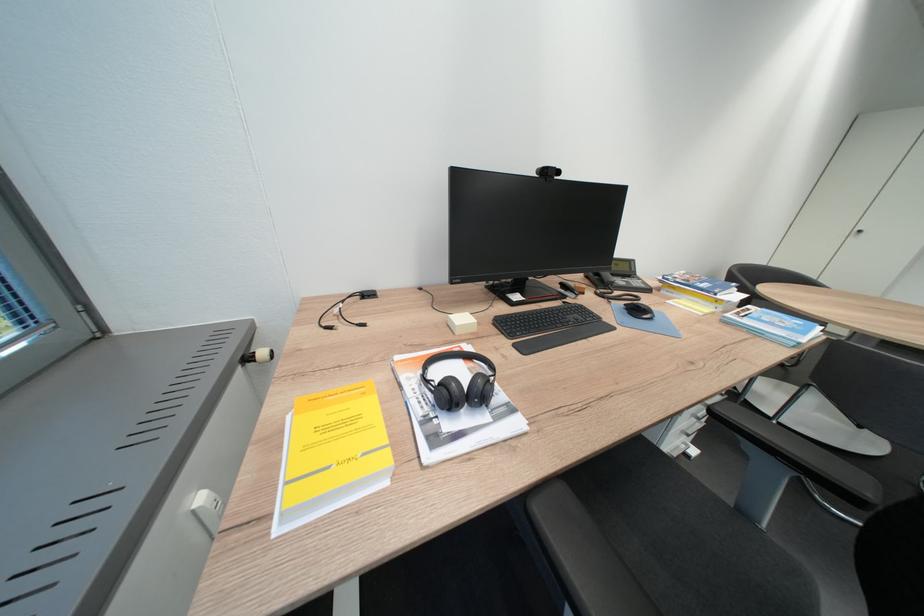
Describe the element at coordinates (615, 293) in the screenshot. The image size is (924, 616). I see `the telephone handset` at that location.